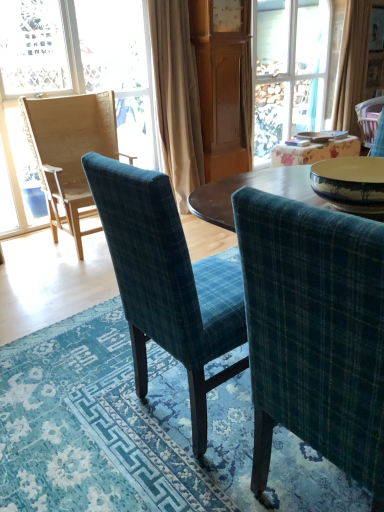
Where is `empty space that is ontop of blue textured rug at center (from a real-world perspective)`? This screenshot has height=512, width=384. empty space that is ontop of blue textured rug at center (from a real-world perspective) is located at coordinates (159, 403).